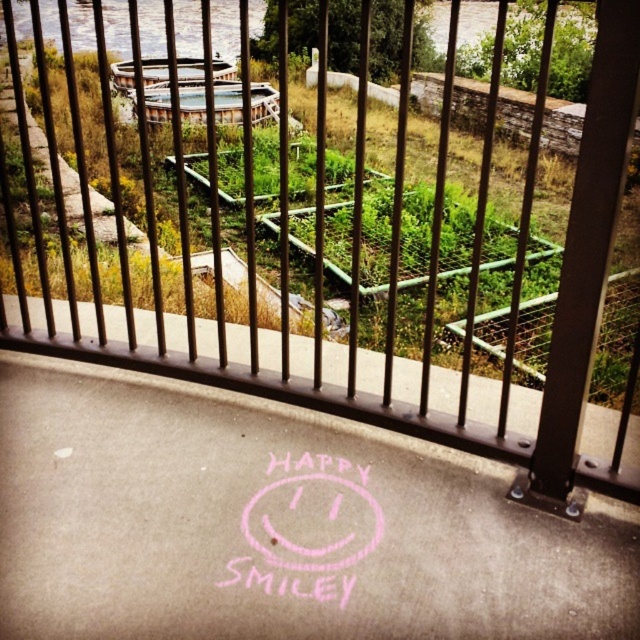
You are an artist who wants to place a new chalk drawing next to the pink chalk drawing at center and the pink chalk smiley face at center. What is the minimum distance you need to maintain between the new drawing and the existing ones to ensure they don

The pink chalk drawing at center is 7.02 inches away from the pink chalk smiley face at center. To ensure the new drawing doesn

You are standing at the railing and want to draw a new chalk heart to the right of the pink chalk smiley face at center. Will the heart be to the right of the pink chalk drawing at center as well?

The pink chalk drawing at center is to the left of the pink chalk smiley face at center. Therefore, drawing a heart to the right of the pink chalk smiley face at center would place it further to the right than the pink chalk drawing at center.

You are a visitor standing near the metal railing looking at the pink chalk drawing at center and the pink chalk smiley face at center. Which object is closer to you?

The pink chalk drawing at center is closer to the viewer than the pink chalk smiley face at center.